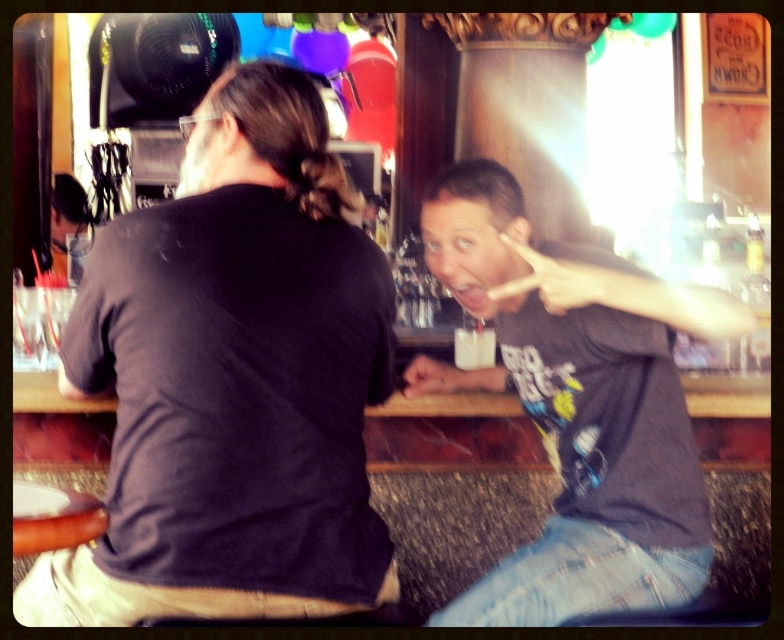
Consider the image. Who is more forward, (205,513) or (565,380)?

Point (205,513) is in front.

Can you confirm if black matte shirt at center is smaller than dark gray t-shirt at center?

Yes, black matte shirt at center is smaller than dark gray t-shirt at center.

Measure the distance between black matte shirt at center and camera.

1.78 meters

Where is `black matte shirt at center`? The width and height of the screenshot is (784, 640). black matte shirt at center is located at coordinates (231, 381).